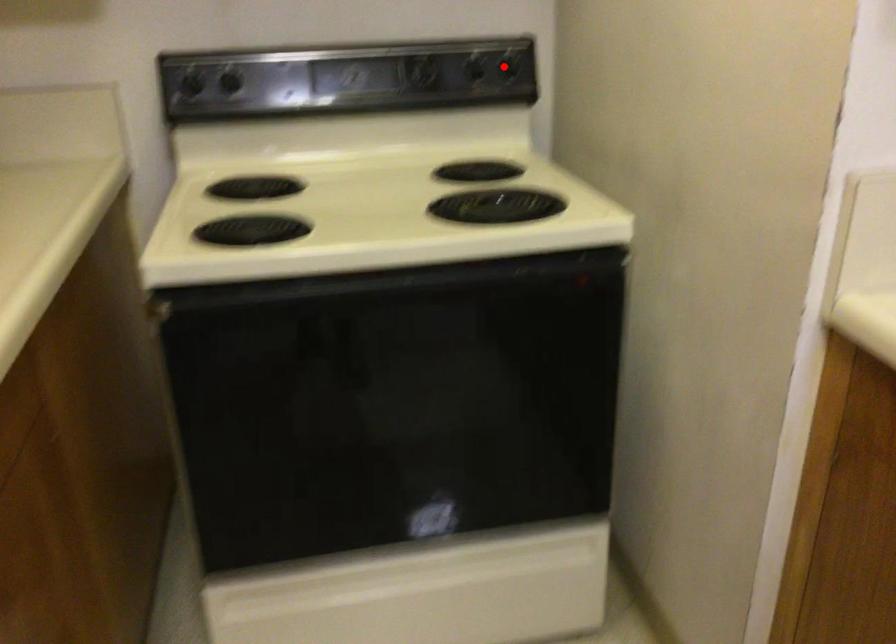
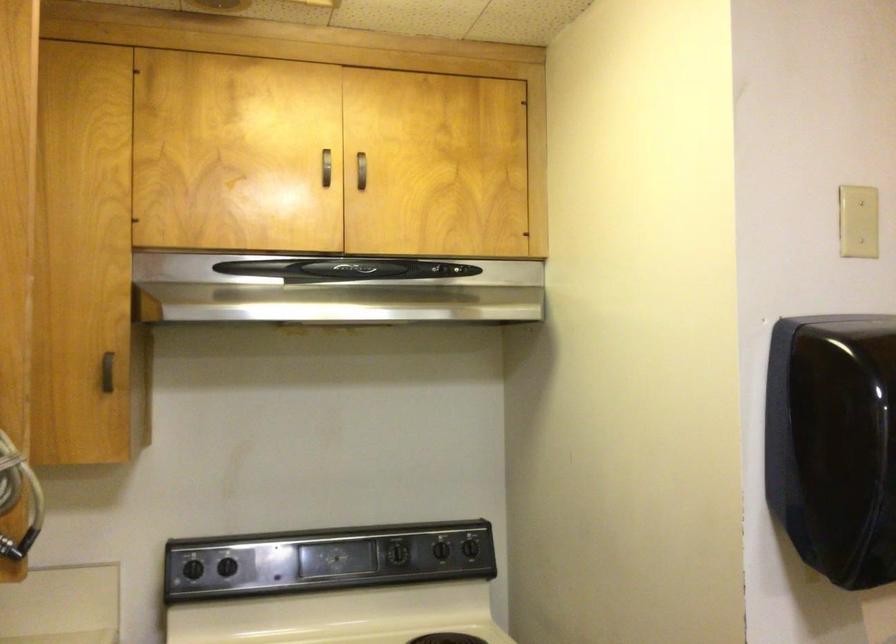
Question: A red point is marked in image1. In image2, is the corresponding 3D point closer to the camera or farther? Reply with the corresponding letter.

Choices:
 (A) The corresponding 3D point is closer.
 (B) The corresponding 3D point is farther.

Answer: (B)